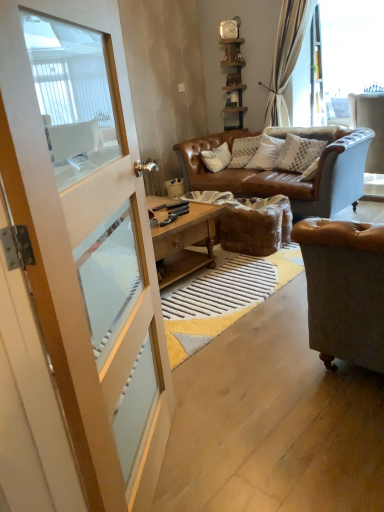
At what (x,y) coordinates should I click in order to perform the action: click on vacant space that is in between white wood screen door at left and brown leather footrest at center. Please return your answer as a coordinate pair (x, y). Looking at the image, I should click on [x=226, y=324].